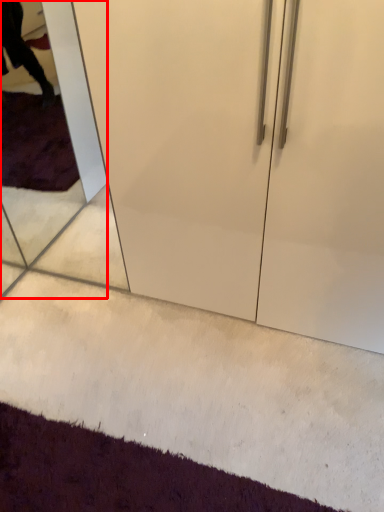
Question: In this image, where is glass door (annotated by the red box) located relative to doormat?

Choices:
 (A) right
 (B) left

Answer: (B)